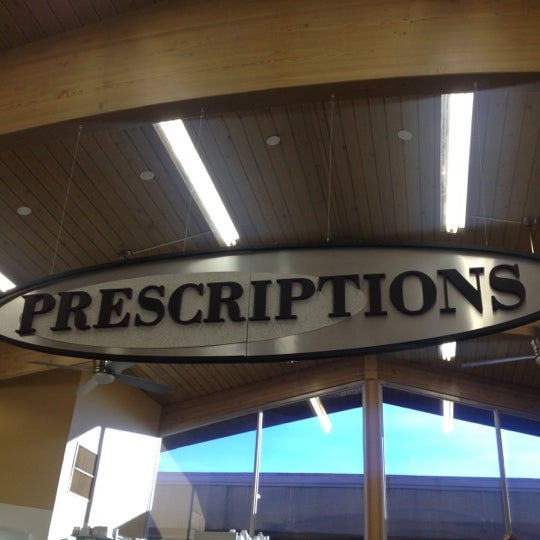
This screenshot has height=540, width=540. Identify the location of wooden ceiling. (36, 238), (212, 384), (481, 357).